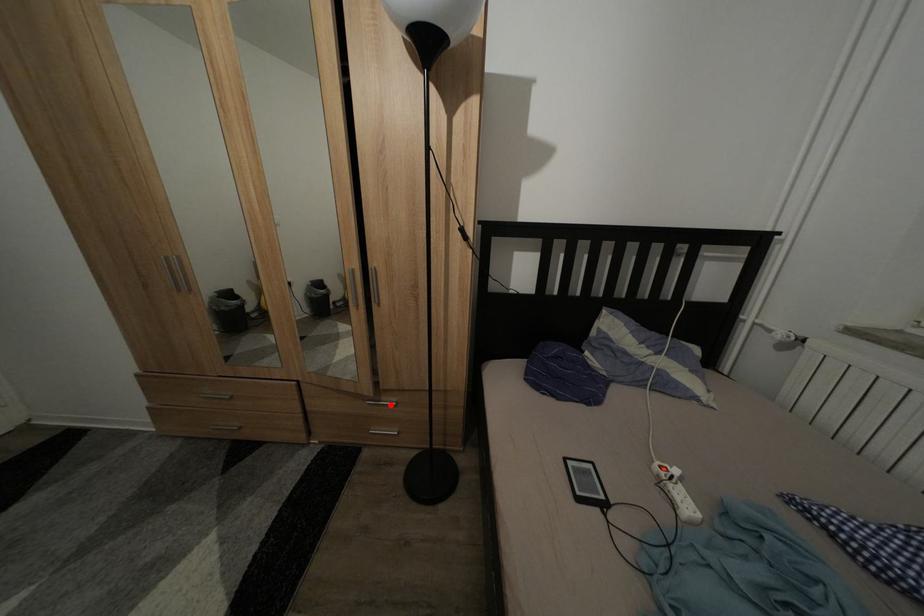
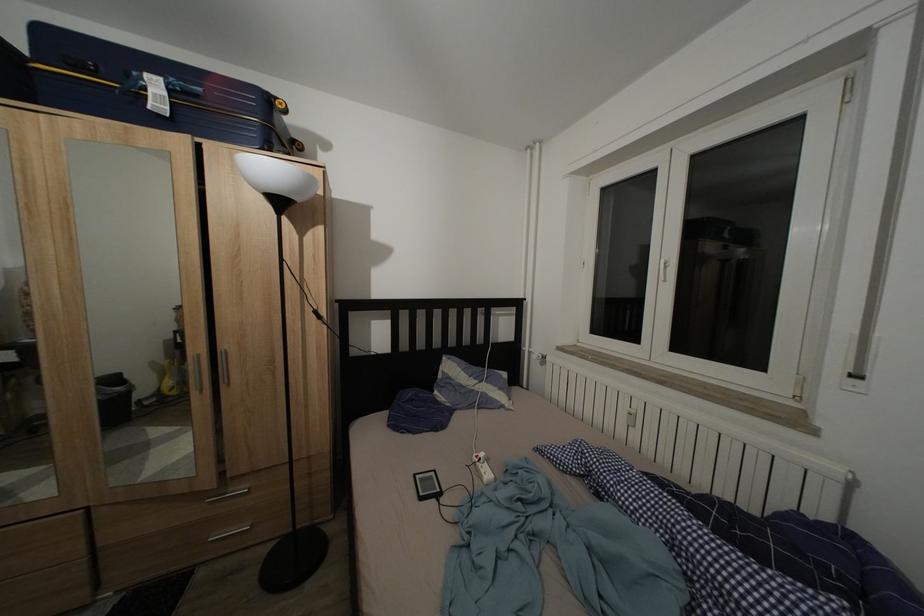
Question: A red point is marked in image1. In image2, is the corresponding 3D point closer to the camera or farther? Reply with the corresponding letter.

Choices:
 (A) The corresponding 3D point is closer.
 (B) The corresponding 3D point is farther.

Answer: (A)